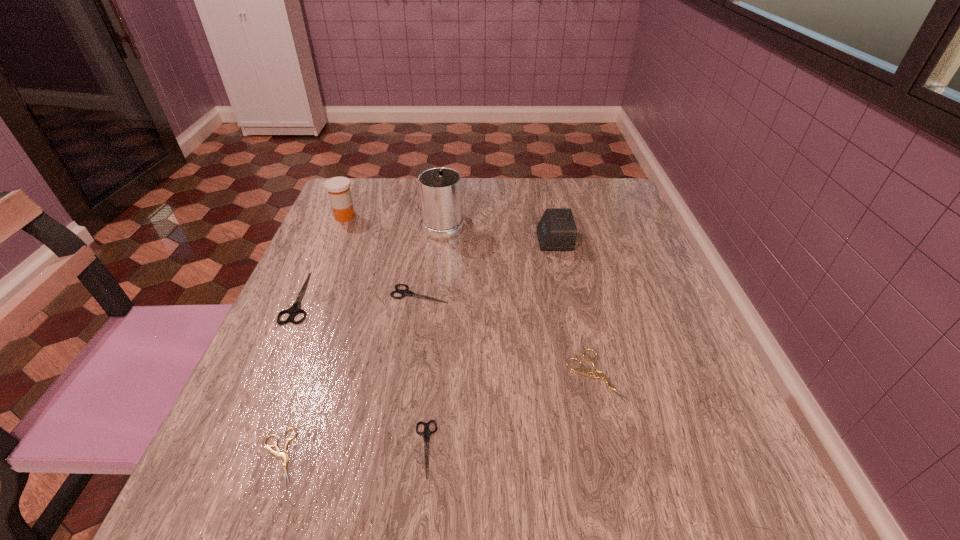
Find the location of a particular element. object located at the near left corner is located at coordinates (285, 456).

Find the location of a particular element. The height and width of the screenshot is (540, 960). vacant space at the left edge is located at coordinates (365, 268).

In the image, there is a desktop. Identify the location of vacant region at the right edge. The height and width of the screenshot is (540, 960). (612, 242).

You are a GUI agent. You are given a task and a screenshot of the screen. Output one action in this format:
    pyautogui.click(x=<x>, y=<y>)
    Task: Click on the vacant region at the far left corner
    
    Given the screenshot: What is the action you would take?
    pyautogui.click(x=372, y=206)

The width and height of the screenshot is (960, 540). Find the location of `vacant area at the near left corner`. vacant area at the near left corner is located at coordinates (208, 487).

Where is `vacant space at the far right corner`? The width and height of the screenshot is (960, 540). vacant space at the far right corner is located at coordinates (611, 183).

Locate an element on the screen. This screenshot has width=960, height=540. free space between the second tallest object and the leftmost shears is located at coordinates (323, 257).

At what (x,y) coordinates should I click in order to perform the action: click on unoccupied area between the tallest object and the bigger beige shears. Please return your answer as a coordinate pair (x, y). The width and height of the screenshot is (960, 540). Looking at the image, I should click on (519, 299).

Where is `vacant region between the seventh shortest object and the rightmost shears`? The image size is (960, 540). vacant region between the seventh shortest object and the rightmost shears is located at coordinates (470, 296).

Locate an element on the screen. Image resolution: width=960 pixels, height=540 pixels. free space between the fourth shears from right to left and the smallest black shears is located at coordinates (352, 453).